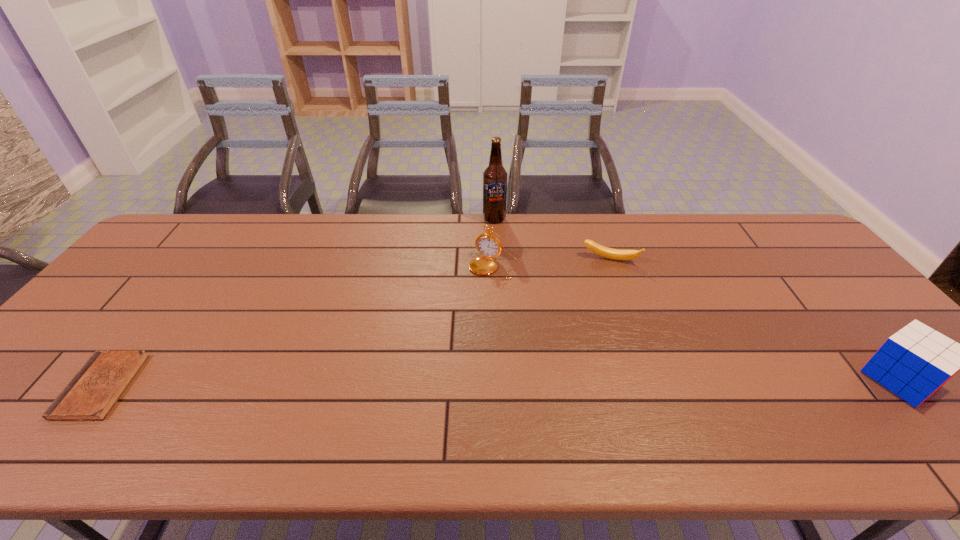
Locate an element on the screen. vacant space located on the face of the pocket watch is located at coordinates (459, 323).

Image resolution: width=960 pixels, height=540 pixels. What are the coordinates of `free space located 0.400m on the face of the pocket watch` in the screenshot? It's located at (422, 385).

Where is `vacant space situated on the label of the beer bottle`? vacant space situated on the label of the beer bottle is located at coordinates (483, 287).

The image size is (960, 540). What are the coordinates of `free space located 0.240m on the label of the beer bottle` in the screenshot? It's located at (486, 269).

Image resolution: width=960 pixels, height=540 pixels. In order to click on free space located on the label of the beer bottle in this screenshot , I will do `click(488, 261)`.

Locate an element on the screen. This screenshot has height=540, width=960. free spot located at the stem of the banana is located at coordinates coord(607,282).

The image size is (960, 540). In order to click on free region located at the stem of the banana in this screenshot , I will do `click(606, 338)`.

Find the location of a particular element. blank space located at the stem of the banana is located at coordinates (606, 338).

The image size is (960, 540). I want to click on pocket watch at the far edge, so click(488, 245).

What are the coordinates of `beer bottle present at the far edge` in the screenshot? It's located at (495, 176).